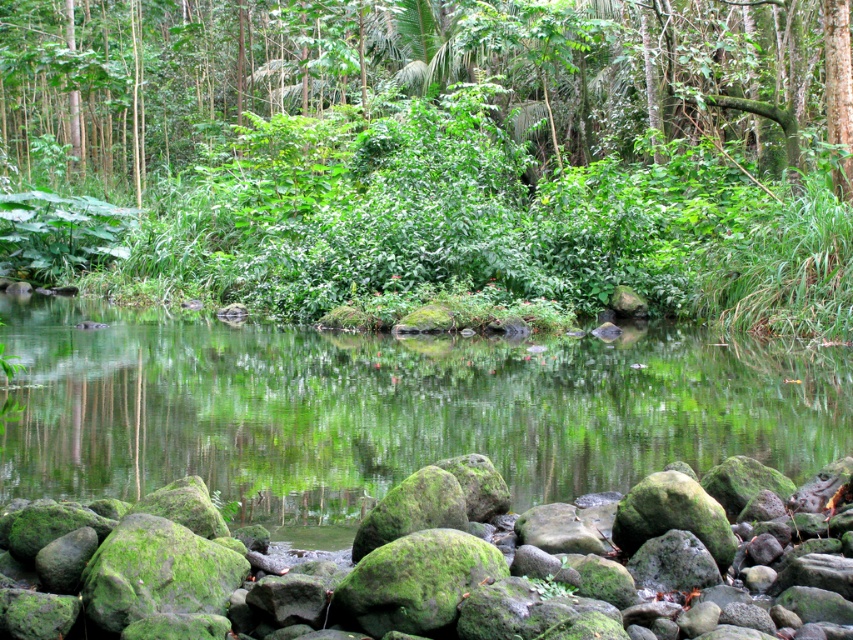
Describe the element at coordinates (392, 410) in the screenshot. I see `green mossy rocks at center` at that location.

Which is above, green mossy rocks at center or green mossy rock at lower center?

Positioned higher is green mossy rocks at center.

Is point (463, 420) positioned after point (158, 609)?

Yes, it is.

Find the location of a particular element. The image size is (853, 640). green mossy rocks at center is located at coordinates (392, 410).